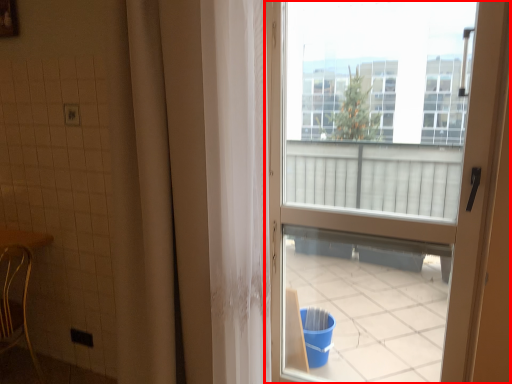
Question: From the image's perspective, what is the correct spatial relationship of door (annotated by the red box) in relation to chair?

Choices:
 (A) above
 (B) below

Answer: (A)